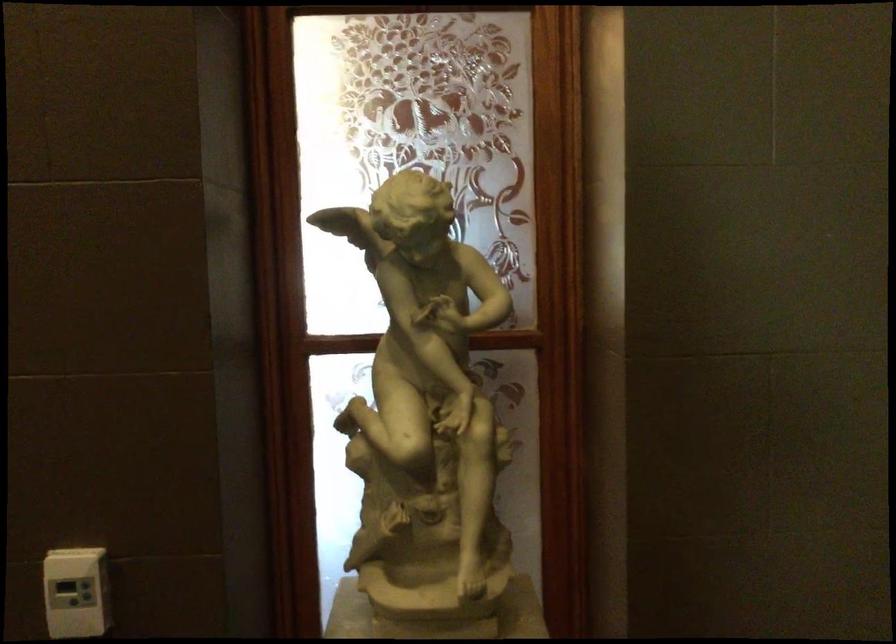
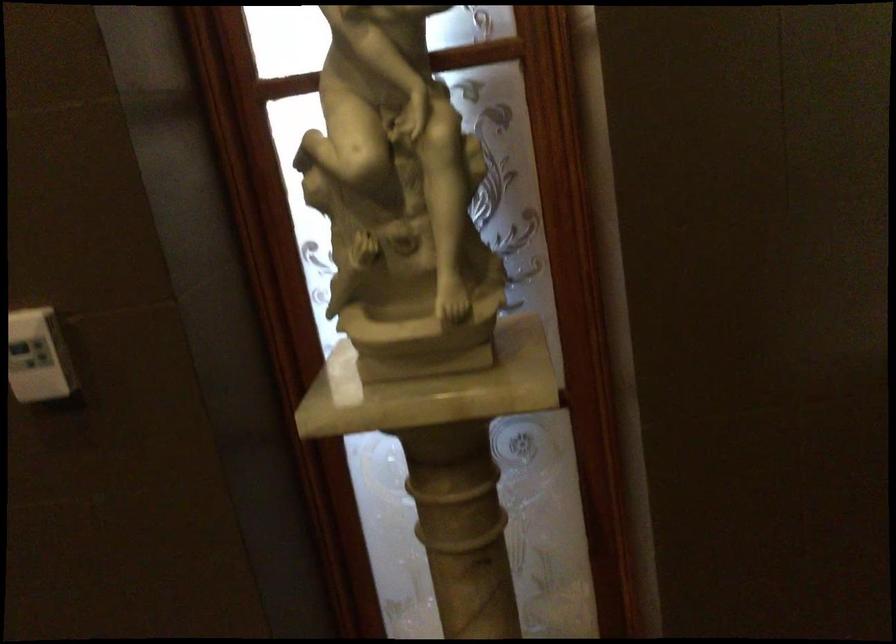
Question: The first image is from the beginning of the video and the second image is from the end. How did the camera likely rotate when shooting the video?

Choices:
 (A) Left
 (B) Right
 (C) Up
 (D) Down

Answer: (D)